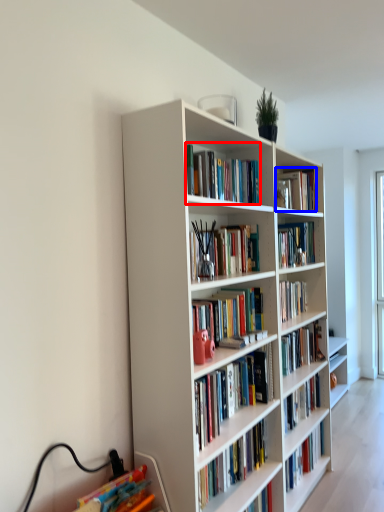
Question: Which object is closer to the camera taking this photo, book (highlighted by a red box) or book (highlighted by a blue box)?

Choices:
 (A) book
 (B) book

Answer: (A)